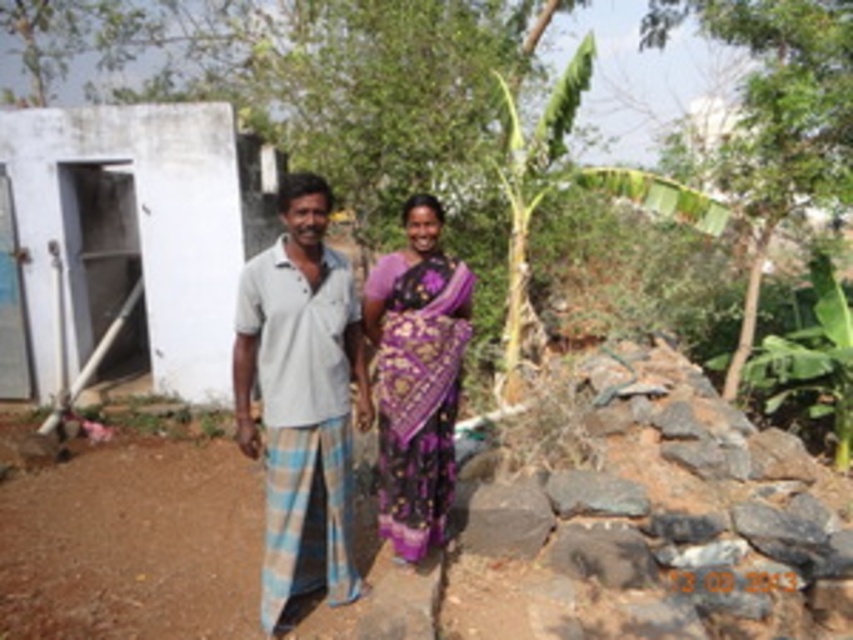
You are a photographer planning to capture a portrait of the two people in the scene. You want to ensure that both the purple woven sari at center and the green leafy banana tree at right are visible in the frame. Given that your camera has a maximum focal length that allows a field of view covering 4 meters, will you be able to include both objects in the same shot?

The distance between the purple woven sari at center and the green leafy banana tree at right is 4.01 meters. Since the camera can only cover up to 4 meters, the photographer will not be able to include both objects in the same shot as the distance exceeds the maximum field of view.

You are standing at the center of the image and want to go to the white concrete hut at left. Which direction should you face to walk towards it?

The white concrete hut at left is located at point 0.367 on the x axis and 0.158 on the y axis. Since you are at the center, you should face towards the left side of the image to walk towards the white concrete hut at left.